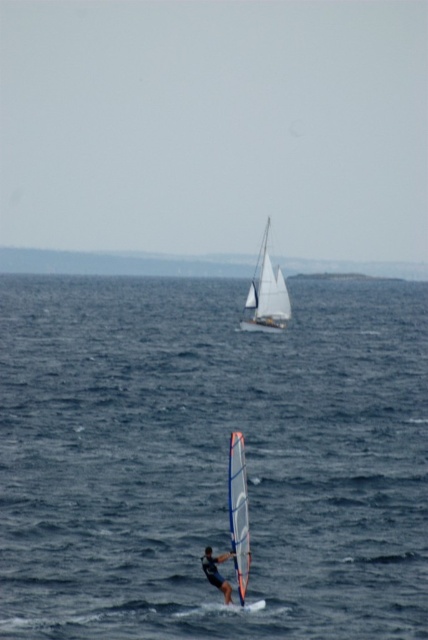
Is blue water at center smaller than dark blue wetsuit at lower center?

No.

Can you confirm if blue water at center is positioned above dark blue wetsuit at lower center?

Indeed, blue water at center is positioned over dark blue wetsuit at lower center.

Who is more forward, (253, 618) or (211, 556)?

Point (211, 556) is in front.

The height and width of the screenshot is (640, 428). I want to click on blue water at center, so click(x=211, y=458).

Which is in front, point (252, 288) or point (219, 554)?

Point (219, 554) is in front.

Is point (272, 326) farther from camera compared to point (204, 554)?

That is True.

The width and height of the screenshot is (428, 640). Find the location of `white sailboat at center`. white sailboat at center is located at coordinates (267, 296).

Who is taller, blue water at center or white sailboat at center?

blue water at center is taller.

Is point (202, 333) positioned after point (267, 332)?

That is True.

Locate an element on the screen. The width and height of the screenshot is (428, 640). blue water at center is located at coordinates (211, 458).